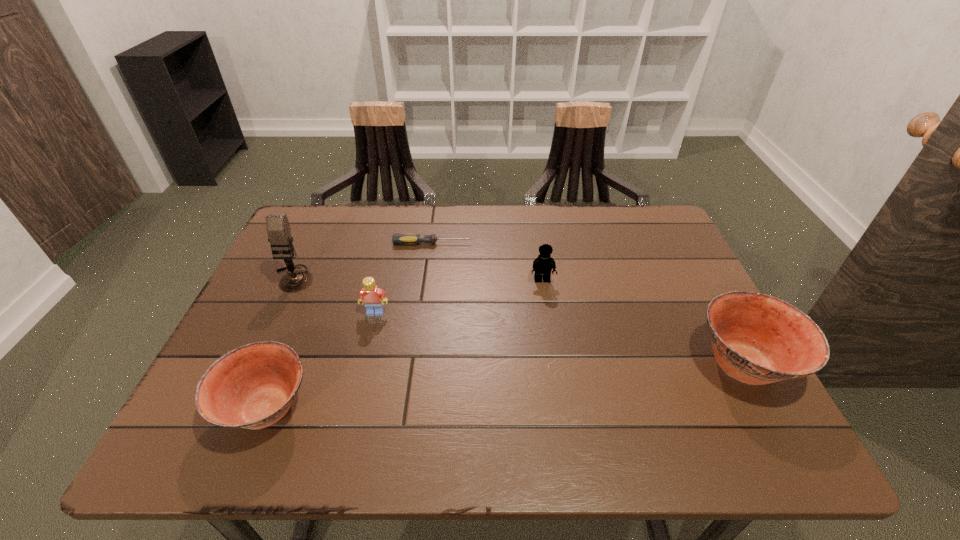
Identify the location of free space located 0.170m on the right of the shorter bowl. This screenshot has height=540, width=960. (398, 409).

This screenshot has height=540, width=960. Identify the location of vacant space located on the left of the rightmost object. (619, 365).

This screenshot has height=540, width=960. Identify the location of free location located 0.320m on the front-facing side of the right Lego. (560, 393).

Where is `vacant area situated insert the shortest object into a screw head`? The image size is (960, 540). vacant area situated insert the shortest object into a screw head is located at coordinates (558, 244).

Image resolution: width=960 pixels, height=540 pixels. Identify the location of free space located 0.120m on the front-facing side of the tallest object. (270, 328).

Locate an element on the screen. The image size is (960, 540). vacant space located 0.100m on the front-facing side of the third nearest object is located at coordinates (367, 349).

Locate an element on the screen. object that is at the far edge is located at coordinates (413, 239).

At what (x,y) coordinates should I click in order to perform the action: click on bowl situated at the left edge. Please return your answer as a coordinate pair (x, y). The width and height of the screenshot is (960, 540). Looking at the image, I should click on (252, 387).

Locate an element on the screen. The width and height of the screenshot is (960, 540). microphone at the left edge is located at coordinates (278, 229).

Locate an element on the screen. object present at the right edge is located at coordinates (757, 339).